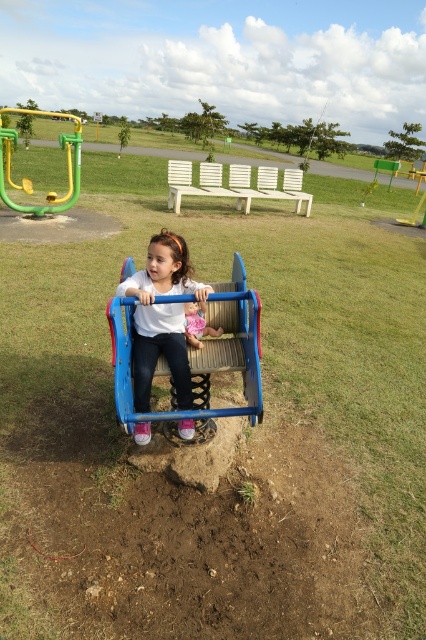
Who is positioned more to the left, white matte shirt at center or smooth pink doll at center?

Positioned to the left is white matte shirt at center.

Does point (149, 406) come behind point (195, 307)?

No, it is in front of (195, 307).

Measure the distance between white matte shirt at center and camera.

They are 9.46 feet apart.

Locate an element on the screen. Image resolution: width=426 pixels, height=640 pixels. white matte shirt at center is located at coordinates (161, 317).

Does white matte shirt at center appear over green plastic monkey bars at upper left?

Incorrect, white matte shirt at center is not positioned above green plastic monkey bars at upper left.

Is white matte shirt at center thinner than green plastic monkey bars at upper left?

Indeed, white matte shirt at center has a lesser width compared to green plastic monkey bars at upper left.

Who is more forward, (154, 298) or (74, 150)?

Positioned in front is point (154, 298).

Identify the location of white matte shirt at center. (161, 317).

Is the position of green plastic monkey bars at upper left more distant than that of smooth pink doll at center?

That is True.

Is green plastic monkey bars at upper left shorter than smooth pink doll at center?

No, green plastic monkey bars at upper left is not shorter than smooth pink doll at center.

Find the location of a particular element. This screenshot has height=640, width=426. green plastic monkey bars at upper left is located at coordinates (66, 163).

Locate an element on the screen. green plastic monkey bars at upper left is located at coordinates (66, 163).